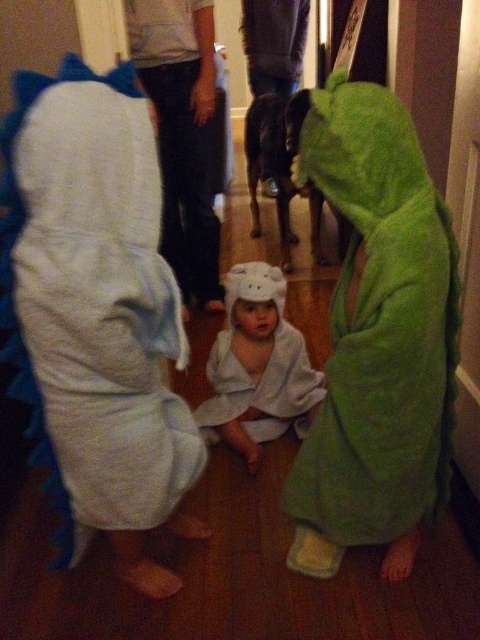
You see two items in the scene, the white fluffy dress at left and the white towel at center. Which one is more to the left?

The white fluffy dress at left is more to the left.